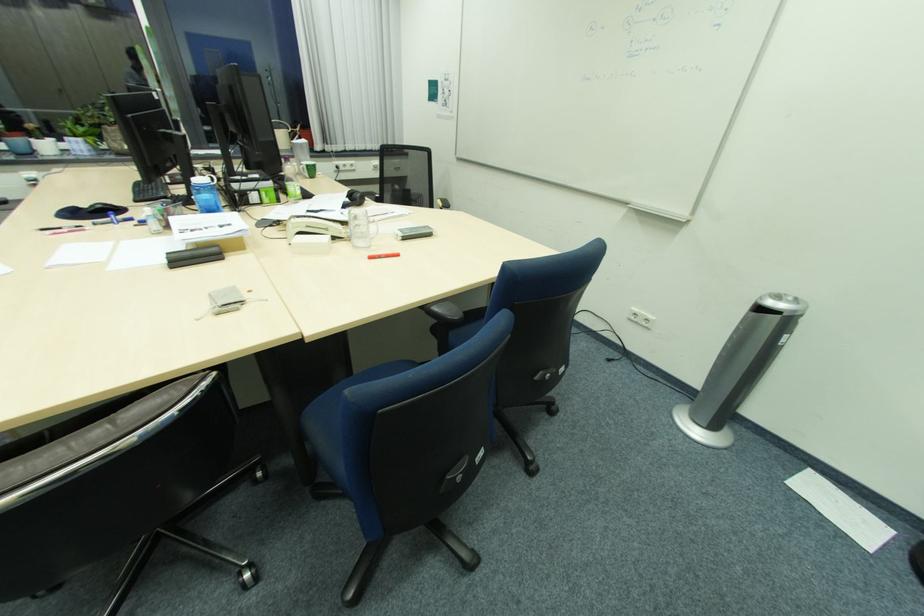
Find where to grip the black headphones. Please return your answer as a coordinate pair (x, y).

(359, 197)